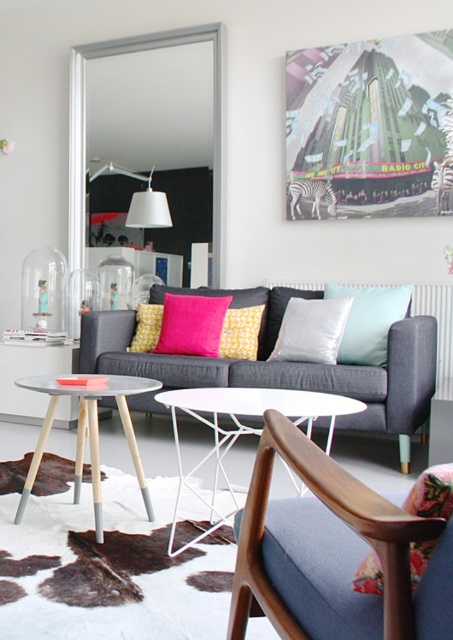
Does concrete wood side table at lower left appear on the left side of pink fabric pillow at center?

Indeed, concrete wood side table at lower left is positioned on the left side of pink fabric pillow at center.

You are a GUI agent. You are given a task and a screenshot of the screen. Output one action in this format:
    pyautogui.click(x=<x>, y=<y>)
    Task: Click on the concrete wood side table at lower left
    This screenshot has height=640, width=453.
    Given the screenshot: What is the action you would take?
    pyautogui.click(x=88, y=433)

Does wooden armchair at lower right have a lesser height compared to yellowtextured fabricpillow at center?

Incorrect, wooden armchair at lower right's height does not fall short of yellowtextured fabricpillow at center's.

Which is behind, point (333, 588) or point (255, 355)?

The point (255, 355) is behind.

Is point (263, 556) closer to camera compared to point (231, 316)?

Yes, point (263, 556) is closer to viewer.

Locate an element on the screen. The width and height of the screenshot is (453, 640). wooden armchair at lower right is located at coordinates (332, 552).

Based on the photo, is wooden armchair at lower right to the left of satin silver pillow at center from the viewer's perspective?

Correct, you'll find wooden armchair at lower right to the left of satin silver pillow at center.

Which of these two, wooden armchair at lower right or satin silver pillow at center, stands shorter?

satin silver pillow at center is shorter.

Is point (279, 593) farther from camera compared to point (305, 305)?

No.

Where is `wooden armchair at lower right`? The width and height of the screenshot is (453, 640). wooden armchair at lower right is located at coordinates (332, 552).